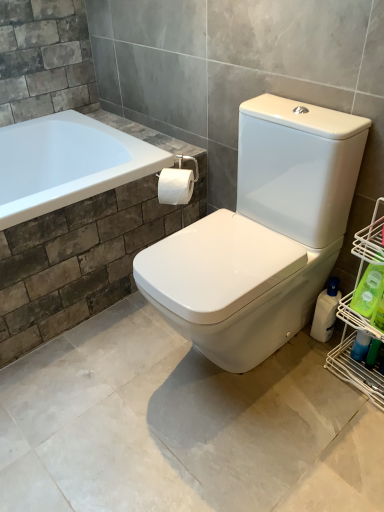
Question: Relative to blue glossy spray bottle at lower right, the second cleaning product in the front-to-back sequence, is green plastic bottle at lower right, acting as the first cleaning product starting from the front, in front or behind?

Choices:
 (A) front
 (B) behind

Answer: (A)

Question: In terms of size, does green plastic bottle at lower right, acting as the first cleaning product starting from the front, appear bigger or smaller than blue glossy spray bottle at lower right, the second cleaning product in the front-to-back sequence?

Choices:
 (A) small
 (B) big

Answer: (B)

Question: Estimate the real-world distances between objects in this image. Which object is farther from the white matte toilet paper at center?

Choices:
 (A) white metal shelf at right
 (B) green plastic bottle at lower right, which is counted as the third cleaning product, starting from the back
 (C) blue glossy spray bottle at lower right, the second cleaning product in the front-to-back sequence
 (D) white plastic bottle at right, the 3th cleaning product from the front

Answer: (C)

Question: Which object is positioned farthest from the blue glossy spray bottle at lower right, which is the second cleaning product from back to front?

Choices:
 (A) green plastic bottle at lower right, acting as the first cleaning product starting from the front
 (B) white matte toilet paper at center
 (C) white plastic bottle at right, the 3th cleaning product from the front
 (D) white metal shelf at right

Answer: (B)